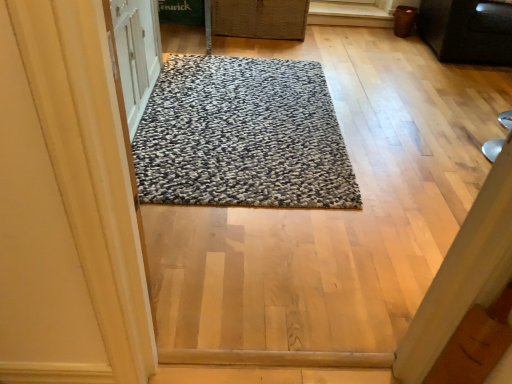
Where is `empty space that is to the right of woven brown basket at upper center`? empty space that is to the right of woven brown basket at upper center is located at coordinates (332, 48).